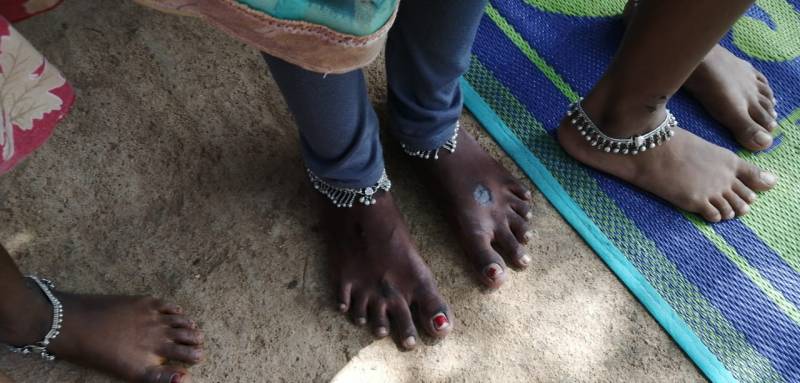
Where is `edging of the hessian mat`? This screenshot has height=383, width=800. edging of the hessian mat is located at coordinates (673, 326).